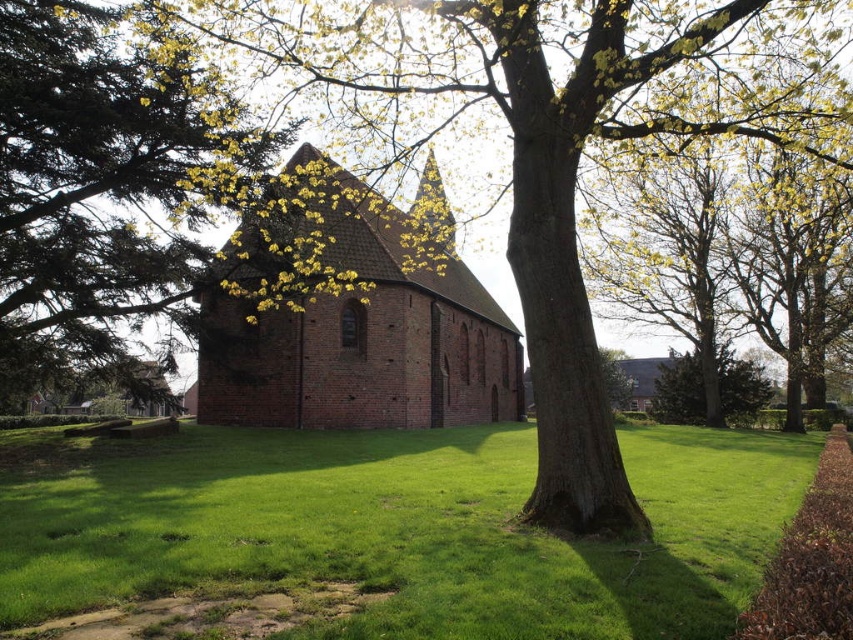
Does smooth bark tree at center come behind brick church at center?

That is False.

Consider the image. Is smooth bark tree at center smaller than brick church at center?

No, smooth bark tree at center is not smaller than brick church at center.

Is point (540, 400) closer to camera compared to point (376, 221)?

Yes, point (540, 400) is closer to viewer.

Locate an element on the screen. smooth bark tree at center is located at coordinates (550, 140).

Is green grass at center further to camera compared to brick church at center?

That is False.

Who is positioned more to the left, green grass at center or brick church at center?

From the viewer's perspective, brick church at center appears more on the left side.

Is point (759, 472) positioned before point (427, 269)?

Yes, it is in front of point (427, 269).

Locate an element on the screen. The height and width of the screenshot is (640, 853). green grass at center is located at coordinates (398, 529).

Who is positioned more to the left, smooth bark tree at center or green leafy tree at center?

Positioned to the left is green leafy tree at center.

Can you confirm if smooth bark tree at center is bigger than green leafy tree at center?

Yes.

At what (x,y) coordinates should I click in order to perform the action: click on smooth bark tree at center. Please return your answer as a coordinate pair (x, y). The width and height of the screenshot is (853, 640). Looking at the image, I should click on (550, 140).

Where is `smooth bark tree at center`? The height and width of the screenshot is (640, 853). smooth bark tree at center is located at coordinates (550, 140).